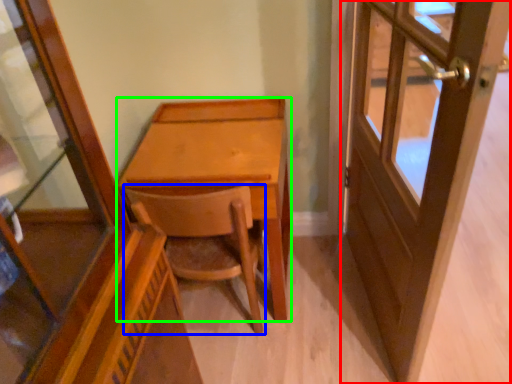
Question: Which object is positioned closest to door (highlighted by a red box)? Select from chair (highlighted by a blue box) and desk (highlighted by a green box).

Choices:
 (A) chair
 (B) desk

Answer: (B)